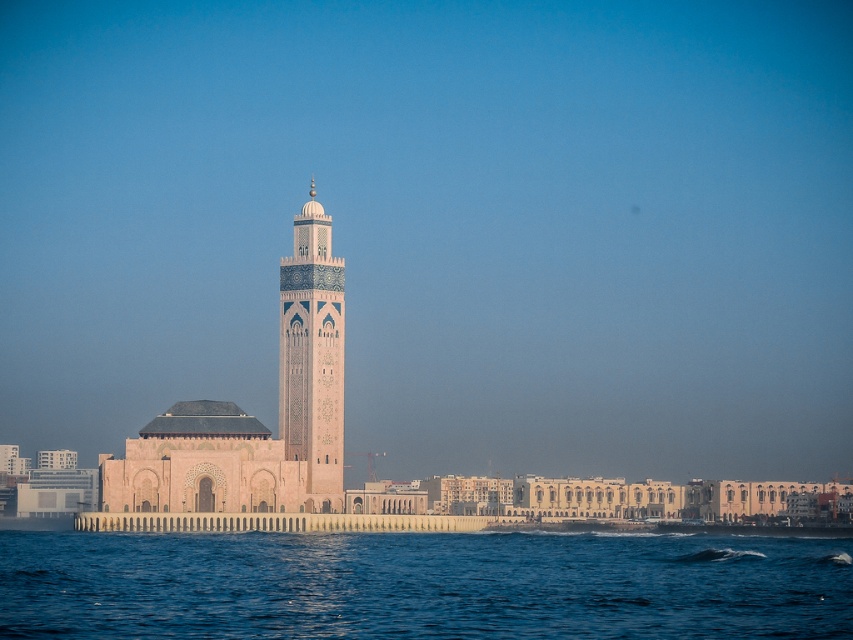
Looking at this image, you are a tourist standing at the edge of the sea looking towards the mosque. You want to take a photo that includes both the blue water at lower center and the pink stone minaret at center. Which object will occupy more space in the photo?

The blue water at lower center will occupy more space in the photo because it is larger in size than the pink stone minaret at center according to the description.

You are standing in front of the mosque and notice the blue water at lower center and the pink stone minaret at center. Which object is positioned to the right of the other?

The blue water at lower center is to the right of the pink stone minaret at center.